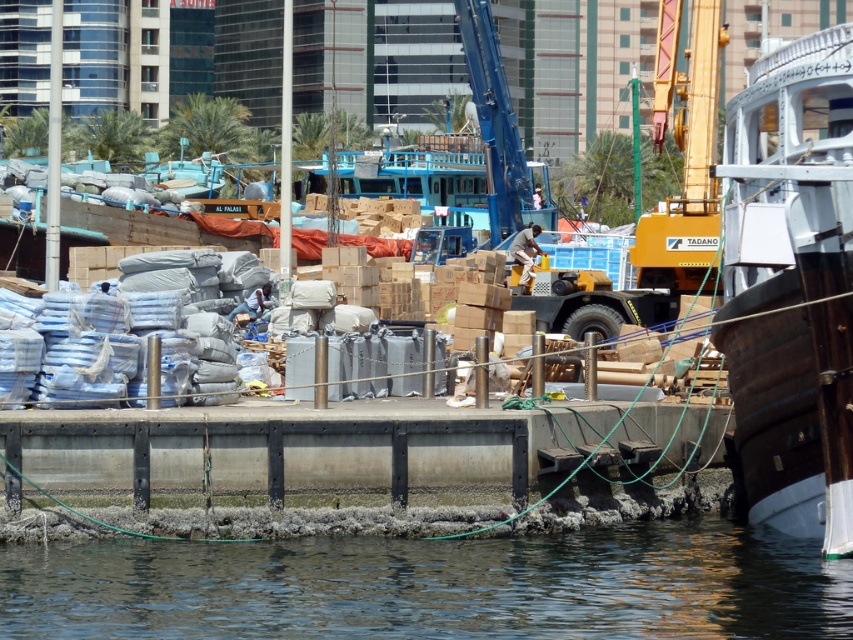
Is wooden boat at right below concrete at center?

Actually, wooden boat at right is above concrete at center.

Image resolution: width=853 pixels, height=640 pixels. I want to click on wooden boat at right, so click(792, 285).

Can you confirm if clear water at lower center is positioned to the right of wooden boat at right?

No, clear water at lower center is not to the right of wooden boat at right.

Is point (160, 577) farther from camera compared to point (839, 408)?

Yes, it is behind point (839, 408).

Between point (421, 605) and point (814, 186), which one is positioned in front?

Point (814, 186) is more forward.

Image resolution: width=853 pixels, height=640 pixels. What are the coordinates of `clear water at lower center` in the screenshot? It's located at (434, 586).

In the scene shown: Is the position of clear water at lower center less distant than that of concrete at center?

Yes, it is in front of concrete at center.

Can you confirm if clear water at lower center is smaller than concrete at center?

No.

Is point (97, 554) positioned before point (708, 440)?

That is True.

Where is `clear water at lower center`? Image resolution: width=853 pixels, height=640 pixels. clear water at lower center is located at coordinates (434, 586).